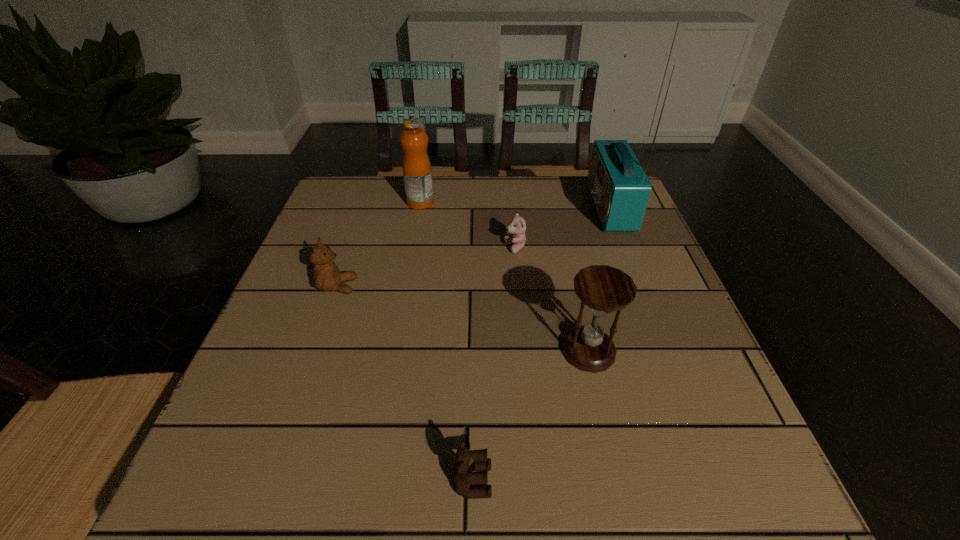
This screenshot has height=540, width=960. What are the coordinates of `empty location between the third tallest object and the leftmost teddy bear` in the screenshot? It's located at (463, 319).

The image size is (960, 540). Find the location of `vacant point located between the nearest teddy bear and the fifth object from left to right`. vacant point located between the nearest teddy bear and the fifth object from left to right is located at coordinates (531, 416).

I want to click on vacant region between the second nearest object and the leftmost teddy bear, so click(x=463, y=319).

Find the location of a particular element. free space between the tallest teddy bear and the third tallest object is located at coordinates (463, 319).

Point out which object is positioned as the second nearest to the hourglass. Please provide its 2D coordinates. Your answer should be formatted as a tuple, i.e. [(x, y)], where the tuple contains the x and y coordinates of a point satisfying the conditions above.

[(517, 227)]

Locate an element on the screen. The image size is (960, 540). object that stands as the fifth closest to the fourth farthest object is located at coordinates (620, 189).

Identify the location of teddy bear that is the second closest one to the leftmost object. Image resolution: width=960 pixels, height=540 pixels. (468, 462).

At what (x,y) coordinates should I click in order to perform the action: click on teddy bear that is the nearest to the third nearest object. Please return your answer as a coordinate pair (x, y). This screenshot has height=540, width=960. Looking at the image, I should click on (517, 227).

This screenshot has width=960, height=540. Find the location of `free spot that satisfies the following two spatial constraints: 1. at the face of the second object from right to left; 2. on the left side of the fourth object from left to right`. free spot that satisfies the following two spatial constraints: 1. at the face of the second object from right to left; 2. on the left side of the fourth object from left to right is located at coordinates (525, 351).

In order to click on vacant space that satisfies the following two spatial constraints: 1. on the face of the leftmost teddy bear; 2. on the back side of the second object from right to left in this screenshot , I will do `click(315, 351)`.